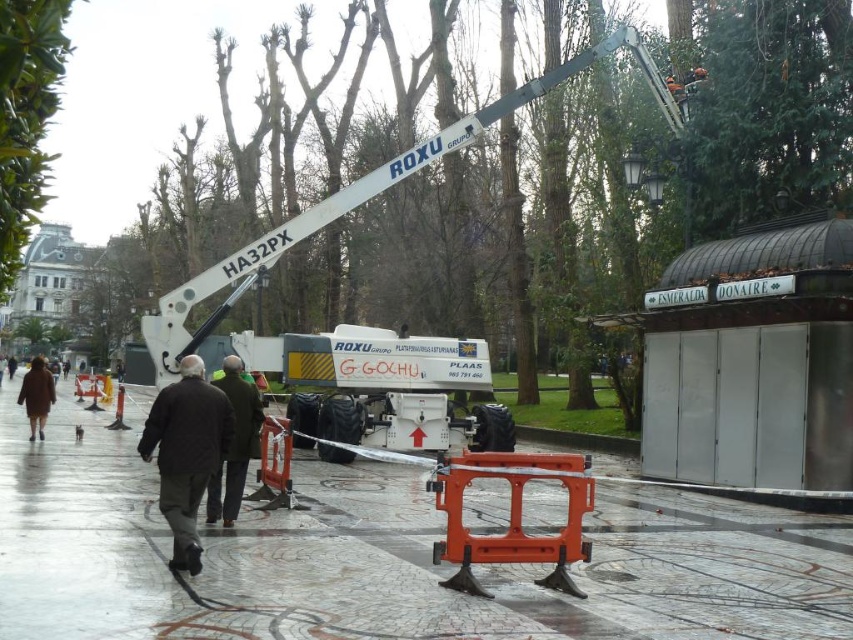
Can you confirm if brown woolen jacket at center is thinner than brown wool coat at lower left?

Yes, brown woolen jacket at center is thinner than brown wool coat at lower left.

Can you confirm if brown woolen jacket at center is wider than brown wool coat at lower left?

In fact, brown woolen jacket at center might be narrower than brown wool coat at lower left.

Is point (186, 451) less distant than point (22, 397)?

Yes, point (186, 451) is closer to viewer.

You are a GUI agent. You are given a task and a screenshot of the screen. Output one action in this format:
    pyautogui.click(x=<x>, y=<y>)
    Task: Click on the brown woolen jacket at center
    Image resolution: width=853 pixels, height=640 pixels.
    Given the screenshot: What is the action you would take?
    pyautogui.click(x=186, y=452)

Does green leafy tree at upper left appear on the right side of brown wool coat at lower left?

Yes, green leafy tree at upper left is to the right of brown wool coat at lower left.

The width and height of the screenshot is (853, 640). In order to click on green leafy tree at upper left in this screenshot , I will do `click(26, 116)`.

Identify the location of green leafy tree at upper left. [26, 116].

Between green leafy tree at upper left and dark brown leather jacket at center, which one has more height?

green leafy tree at upper left is taller.

Based on the photo, is the position of green leafy tree at upper left less distant than that of dark brown leather jacket at center?

Yes, it is in front of dark brown leather jacket at center.

Locate an element on the screen. green leafy tree at upper left is located at coordinates (26, 116).

Where is `green leafy tree at upper left`? The image size is (853, 640). green leafy tree at upper left is located at coordinates (26, 116).